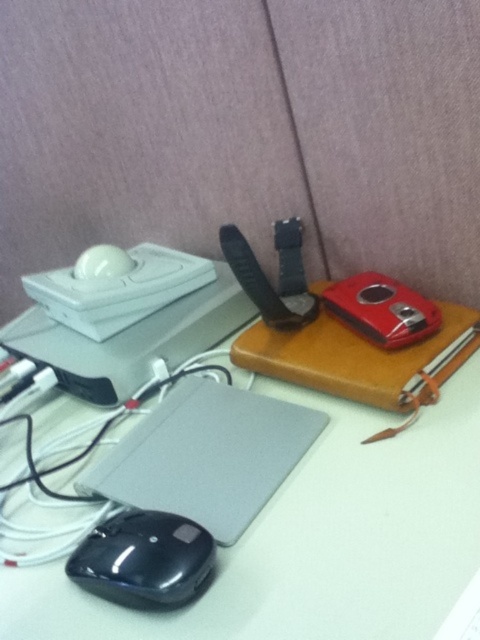
Question: Is white matte table at center smaller than satin black laptop at lower left?

Choices:
 (A) no
 (B) yes

Answer: (A)

Question: Which point appears farthest from the camera in this image?

Choices:
 (A) (373, 508)
 (B) (127, 536)
 (C) (242, 416)

Answer: (C)

Question: Which of the following is the farthest from the observer?

Choices:
 (A) satin black laptop at lower left
 (B) white matte table at center
 (C) black matte mouse at lower left

Answer: (A)

Question: Considering the relative positions of satin black laptop at lower left and black matte mouse at lower left in the image provided, where is satin black laptop at lower left located with respect to black matte mouse at lower left?

Choices:
 (A) right
 (B) left

Answer: (A)

Question: From the image, what is the correct spatial relationship of white matte table at center in relation to black matte mouse at lower left?

Choices:
 (A) above
 (B) below

Answer: (A)

Question: Which point appears closest to the camera in this image?

Choices:
 (A) (307, 412)
 (B) (124, 580)

Answer: (B)